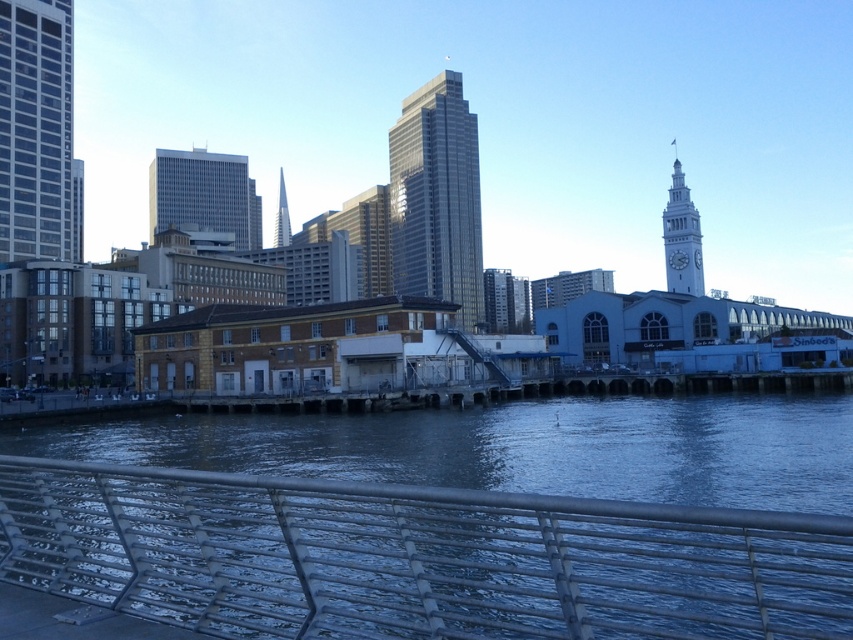
Question: Which point appears closest to the camera in this image?

Choices:
 (A) (280, 202)
 (B) (399, 189)

Answer: (B)

Question: Among these points, which one is nearest to the camera?

Choices:
 (A) (61, 256)
 (B) (456, 186)

Answer: (A)

Question: Which is nearer to the glassy metallic skyscraper at center?

Choices:
 (A) gray glass skyscraper at center-left
 (B) glassy steel skyscraper at left
 (C) white stone clock tower at upper right

Answer: (A)

Question: Does metallic silver rail at lower center appear on the left side of white stone clock tower at upper right?

Choices:
 (A) yes
 (B) no

Answer: (A)

Question: Observing the image, what is the correct spatial positioning of metallic silver rail at lower center in reference to silver metallic spire at center?

Choices:
 (A) above
 (B) below

Answer: (B)

Question: Observing the image, what is the correct spatial positioning of gray glass skyscraper at center-left in reference to silver metallic spire at center?

Choices:
 (A) right
 (B) left

Answer: (B)